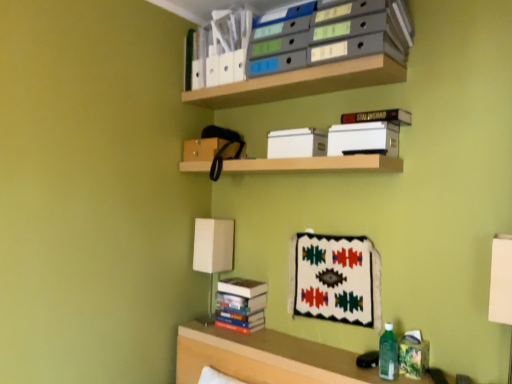
Question: Is matte gray file folders at upper center, marked as the first shelf in a top-to-bottom arrangement, to the left of green translucent bottle at lower right from the viewer's perspective?

Choices:
 (A) yes
 (B) no

Answer: (A)

Question: Considering the relative sizes of matte gray file folders at upper center, arranged as the third shelf when ordered from the bottom, and green translucent bottle at lower right in the image provided, is matte gray file folders at upper center, arranged as the third shelf when ordered from the bottom, wider than green translucent bottle at lower right?

Choices:
 (A) yes
 (B) no

Answer: (A)

Question: Is matte gray file folders at upper center, arranged as the third shelf when ordered from the bottom, directly adjacent to green translucent bottle at lower right?

Choices:
 (A) yes
 (B) no

Answer: (B)

Question: Would you say matte gray file folders at upper center, marked as the first shelf in a top-to-bottom arrangement, is outside green translucent bottle at lower right?

Choices:
 (A) yes
 (B) no

Answer: (A)

Question: Can you confirm if matte gray file folders at upper center, marked as the first shelf in a top-to-bottom arrangement, is positioned to the right of green translucent bottle at lower right?

Choices:
 (A) yes
 (B) no

Answer: (B)

Question: From the image's perspective, would you say matte gray file folders at upper center, marked as the first shelf in a top-to-bottom arrangement, is positioned over green translucent bottle at lower right?

Choices:
 (A) no
 (B) yes

Answer: (B)

Question: From the image's perspective, is hardcover books at lower center, acting as the 2th book starting from the top, beneath hardcover book at upper center, which is the 1th paperback book from right to left?

Choices:
 (A) yes
 (B) no

Answer: (A)

Question: Is hardcover books at lower center, which ranks as the first book in bottom-to-top order, surrounding hardcover book at upper center, which is the third paperback book from left to right?

Choices:
 (A) no
 (B) yes

Answer: (A)

Question: Is hardcover books at lower center, which ranks as the first book in bottom-to-top order, smaller than hardcover book at upper center, which is the 1th paperback book from right to left?

Choices:
 (A) yes
 (B) no

Answer: (B)

Question: Considering the relative positions of hardcover books at lower center, acting as the 2th book starting from the top, and hardcover book at upper center, which is the third paperback book from left to right, in the image provided, is hardcover books at lower center, acting as the 2th book starting from the top, in front of hardcover book at upper center, which is the third paperback book from left to right,?

Choices:
 (A) yes
 (B) no

Answer: (B)

Question: Considering the relative positions of hardcover books at lower center, acting as the 2th book starting from the top, and hardcover book at upper center, which is the 1th paperback book from right to left, in the image provided, is hardcover books at lower center, acting as the 2th book starting from the top, to the right of hardcover book at upper center, which is the 1th paperback book from right to left, from the viewer's perspective?

Choices:
 (A) no
 (B) yes

Answer: (A)

Question: Is hardcover books at lower center, acting as the 2th book starting from the top, looking in the opposite direction of hardcover book at upper center, which is the 1th paperback book from right to left?

Choices:
 (A) no
 (B) yes

Answer: (A)

Question: Is hardcover book at upper center, placed as the 2th paperback book when sorted from right to left, positioned far away from hardcover books at lower center, acting as the 2th book starting from the top?

Choices:
 (A) yes
 (B) no

Answer: (B)